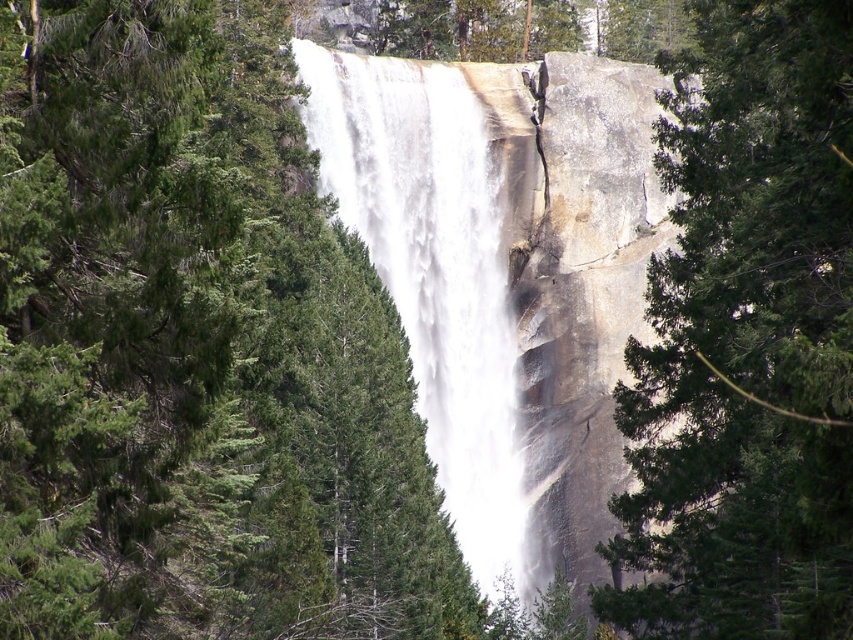
Question: Can you confirm if green textured tree at center is positioned to the right of white frothy water at center?

Choices:
 (A) yes
 (B) no

Answer: (A)

Question: Which of the following is the farthest from the observer?

Choices:
 (A) white frothy water at center
 (B) green textured tree at center

Answer: (A)

Question: Where is green textured tree at center located in relation to white frothy water at center in the image?

Choices:
 (A) left
 (B) right

Answer: (B)

Question: Is green textured tree at center closer to the viewer compared to white frothy water at center?

Choices:
 (A) no
 (B) yes

Answer: (B)

Question: Which point appears closest to the camera in this image?

Choices:
 (A) (395, 93)
 (B) (724, 54)

Answer: (B)

Question: Which point is closer to the camera?

Choices:
 (A) (668, 582)
 (B) (451, 227)

Answer: (A)